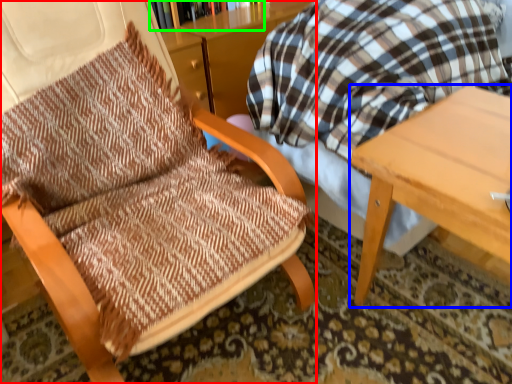
Question: Which is farther away from chair (highlighted by a red box)? table (highlighted by a blue box) or bookcase (highlighted by a green box)?

Choices:
 (A) table
 (B) bookcase

Answer: (B)